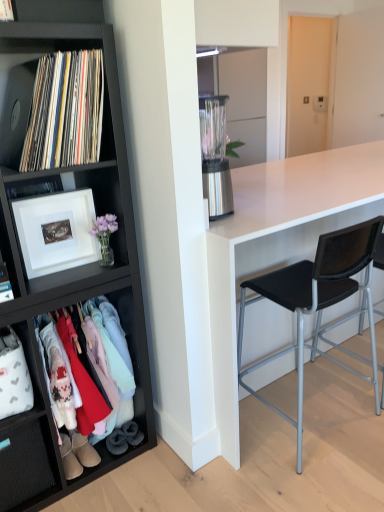
Where is `space that is in front of soft gray suede boot at lower left, which appears as the 2th shoe when viewed from the left`? This screenshot has width=384, height=512. space that is in front of soft gray suede boot at lower left, which appears as the 2th shoe when viewed from the left is located at coordinates (110, 473).